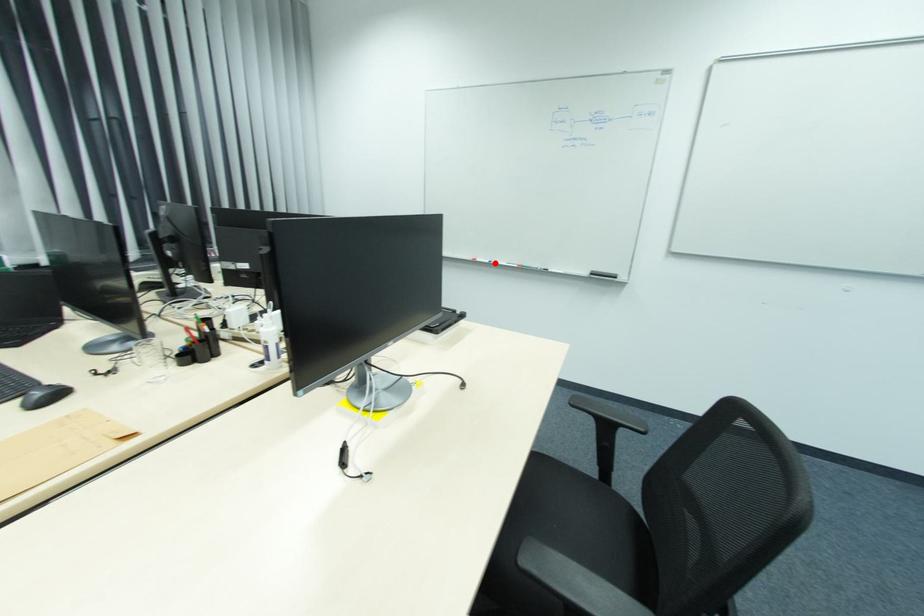
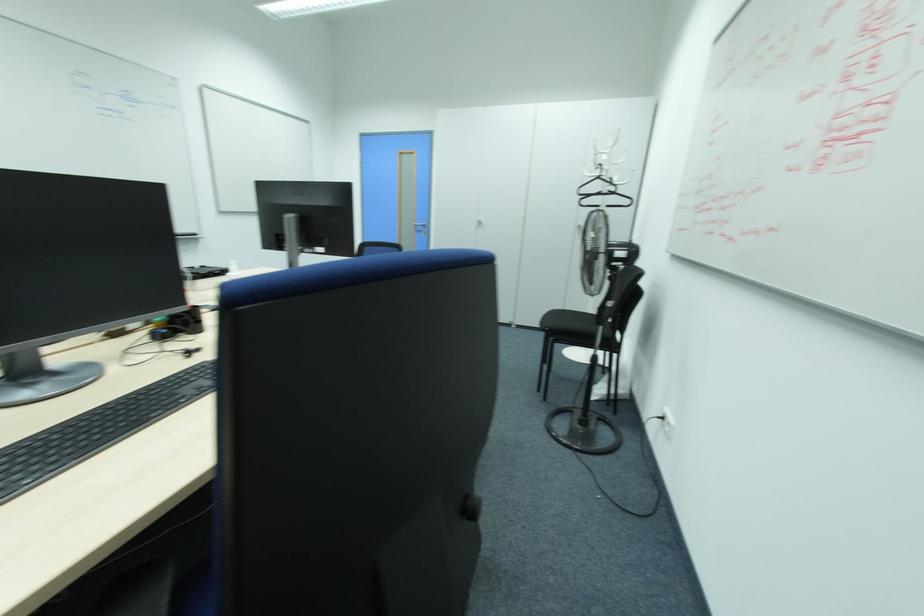
Question: I am providing you with two images of the same scene from different viewpoints. A red point is marked on the first image. Is the red point's position out of view in image 2?

Choices:
 (A) Yes
 (B) No

Answer: (A)